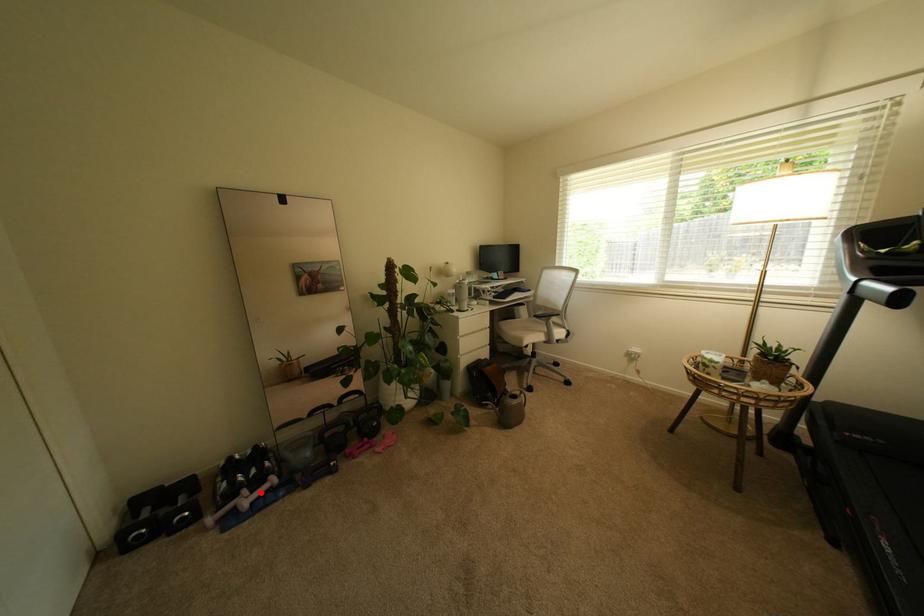
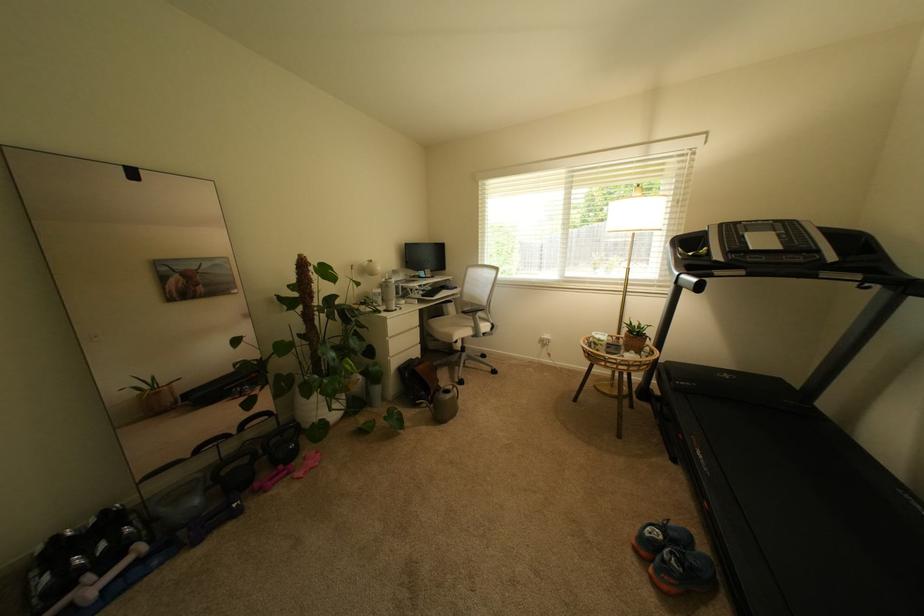
In the second image, find the point that corresponds to the highlighted location in the first image.

(111, 573)